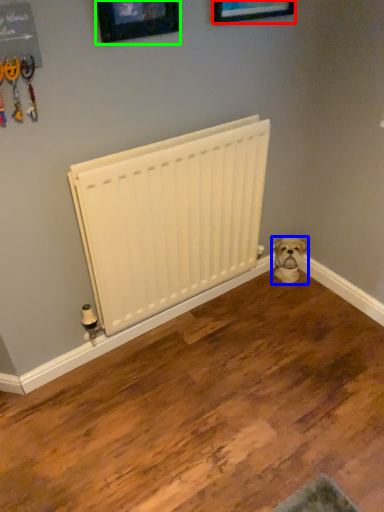
Question: Based on their relative distances, which object is nearer to picture frame (highlighted by a red box)? Choose from dog (highlighted by a blue box) and picture frame (highlighted by a green box).

Choices:
 (A) dog
 (B) picture frame

Answer: (B)